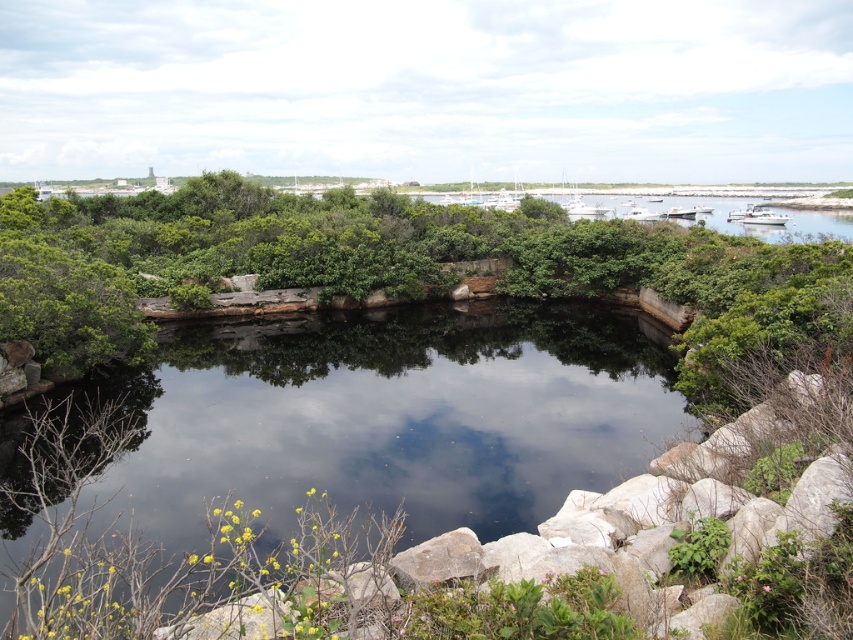
The width and height of the screenshot is (853, 640). What do you see at coordinates (392, 419) in the screenshot?
I see `clear water at center` at bounding box center [392, 419].

Is point (231, 417) farther from camera compared to point (720, 212)?

No.

The image size is (853, 640). I want to click on clear water at center, so click(x=392, y=419).

This screenshot has width=853, height=640. In order to click on clear water at center in this screenshot , I will do `click(392, 419)`.